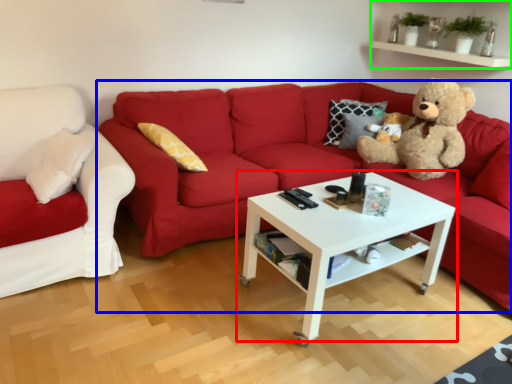
Question: Which object is the closest to the coffee table (highlighted by a red box)? Choose among these: studio couch (highlighted by a blue box) or shelf (highlighted by a green box).

Choices:
 (A) studio couch
 (B) shelf

Answer: (A)